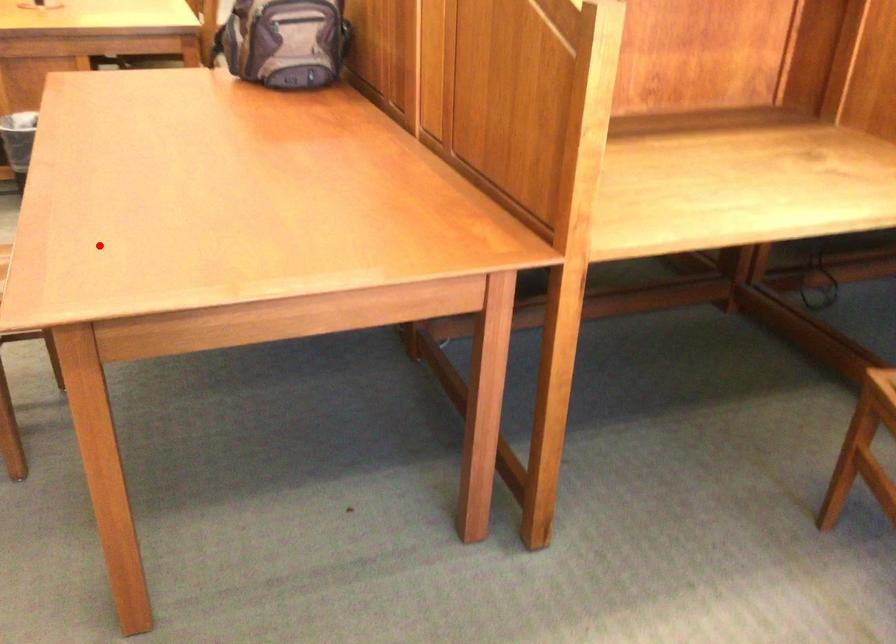
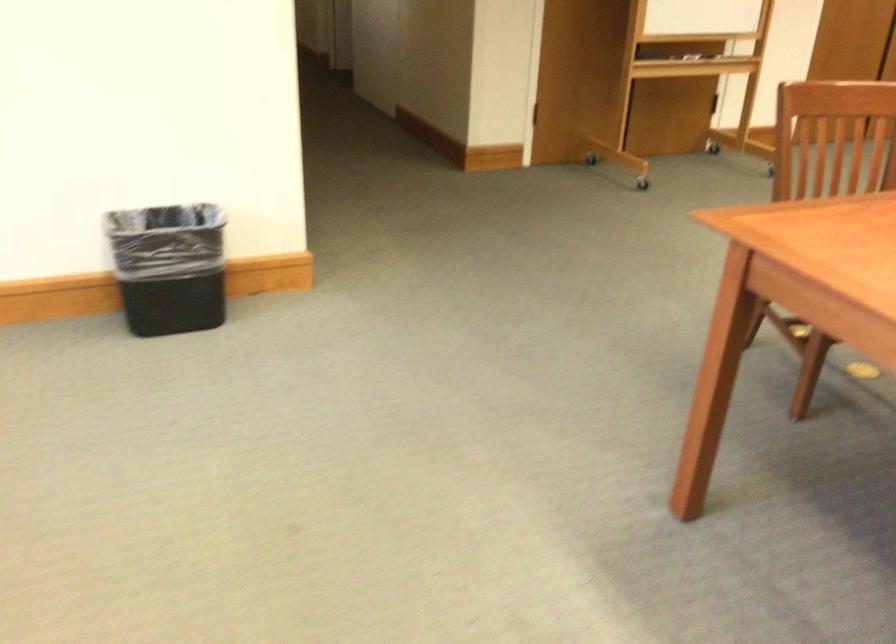
The point at the highlighted location is marked in the first image. Where is the corresponding point in the second image?

(849, 220)